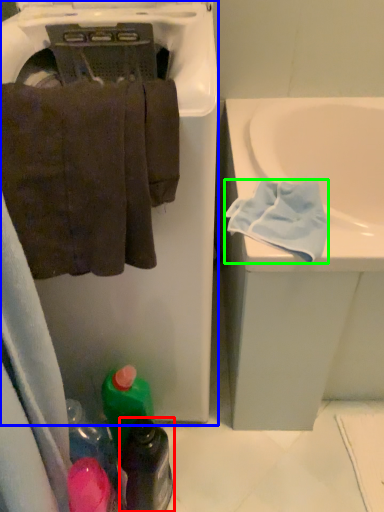
Question: Which is nearer to the bottle (highlighted by a red box)? dish washer (highlighted by a blue box) or bath towel (highlighted by a green box).

Choices:
 (A) dish washer
 (B) bath towel

Answer: (A)